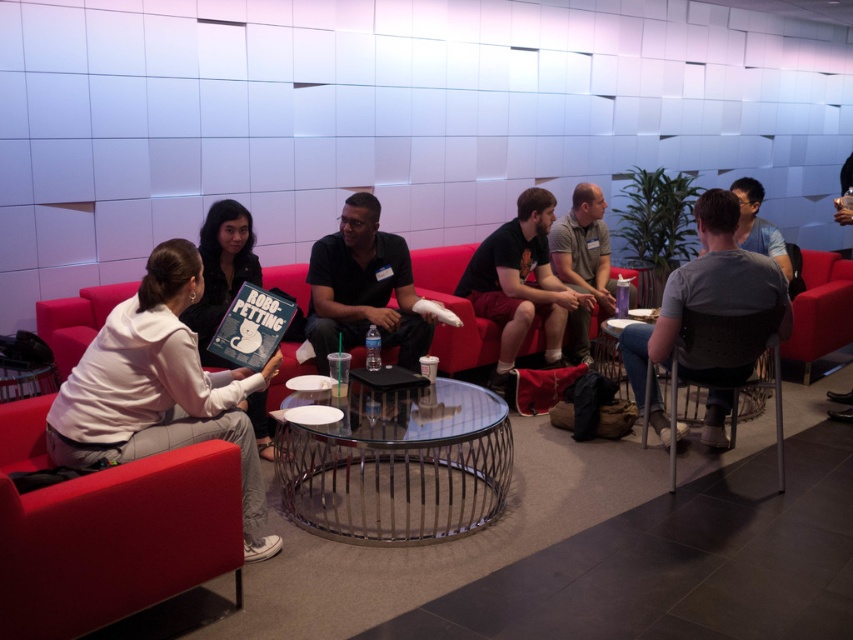
Question: Can you confirm if matte white couch at left is smaller than black mesh chair at lower right?

Choices:
 (A) yes
 (B) no

Answer: (B)

Question: Is white cotton hoodie at left smaller than gray fabric shirt at right?

Choices:
 (A) no
 (B) yes

Answer: (B)

Question: Which point appears farthest from the camera in this image?

Choices:
 (A) (289, 298)
 (B) (724, 381)

Answer: (A)

Question: Considering the real-world distances, which object is closest to the white matte book at center?

Choices:
 (A) black matte shirt at center
 (B) clear glass table at center

Answer: (A)

Question: Is black matte shirt at center smaller than matte black chair at center?

Choices:
 (A) yes
 (B) no

Answer: (A)

Question: Which point appears closest to the camera in this image?

Choices:
 (A) [71, 330]
 (B) [833, 292]
 (C) [352, 449]
 (D) [351, 284]

Answer: (A)